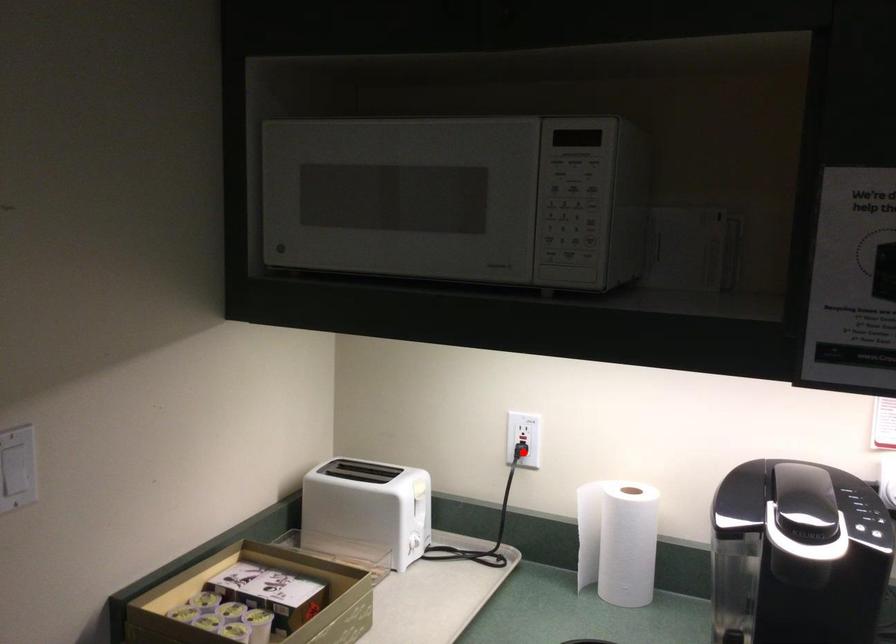
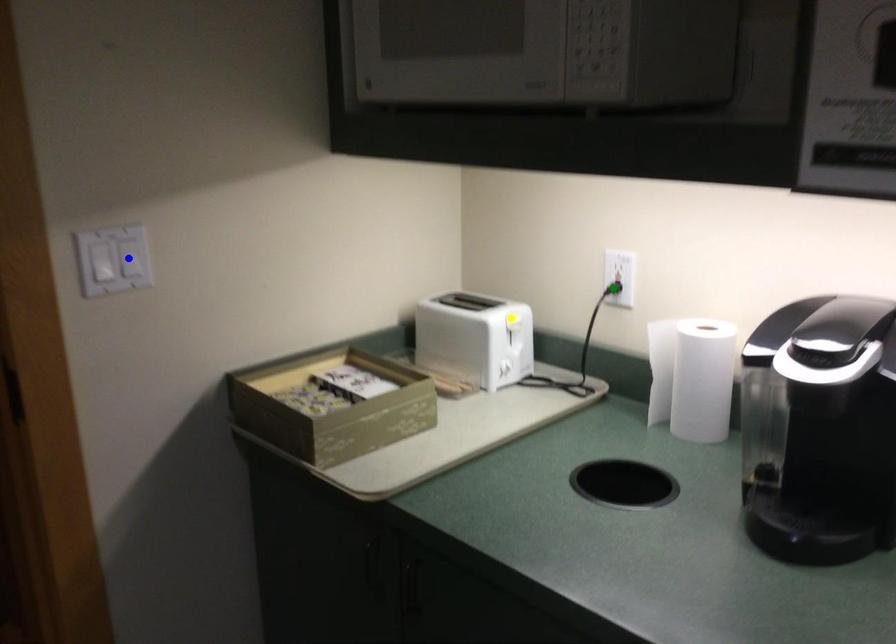
Question: I am providing you with two images of the same scene from different viewpoints. A red point is marked on the first image. You are given multiple points on the second image. Which point in image 2 is actually the same real-world point as the red point in image 1?

Choices:
 (A) yellow point
 (B) blue point
 (C) green point

Answer: (C)